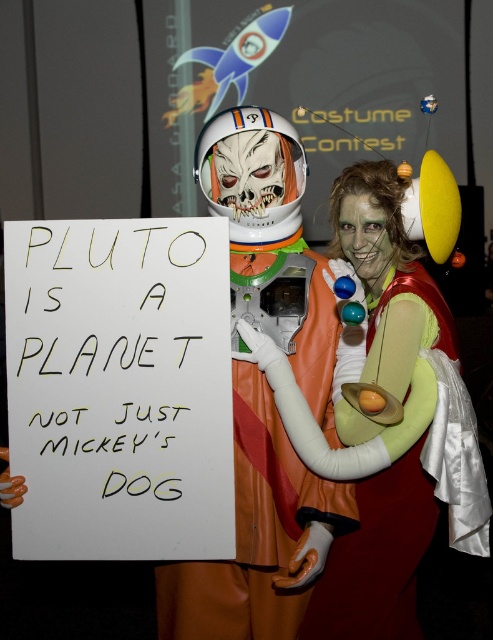
Question: Which point is closer to the camera?

Choices:
 (A) (365, 401)
 (B) (262, 268)

Answer: (A)

Question: Among these objects, which one is nearest to the camera?

Choices:
 (A) green fabric dress at center
 (B) orange latex spacesuit at center

Answer: (A)

Question: Considering the relative positions of green fabric dress at center and orange latex spacesuit at center in the image provided, where is green fabric dress at center located with respect to orange latex spacesuit at center?

Choices:
 (A) right
 (B) left

Answer: (A)

Question: Which point appears farthest from the camera in this image?

Choices:
 (A) (238, 634)
 (B) (381, 273)

Answer: (A)

Question: Is green fabric dress at center positioned in front of orange latex spacesuit at center?

Choices:
 (A) yes
 (B) no

Answer: (A)

Question: Can you confirm if green fabric dress at center is thinner than orange latex spacesuit at center?

Choices:
 (A) yes
 (B) no

Answer: (B)